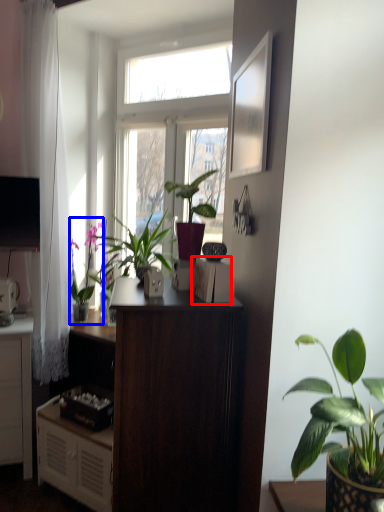
Question: Which point is further to the camera, appliance (highlighted by a red box) or houseplant (highlighted by a blue box)?

Choices:
 (A) appliance
 (B) houseplant

Answer: (B)